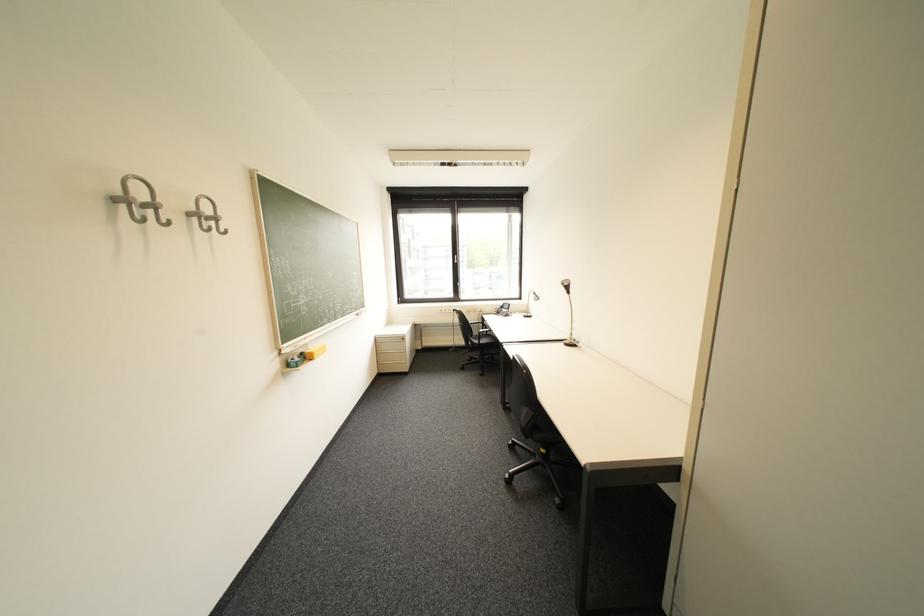
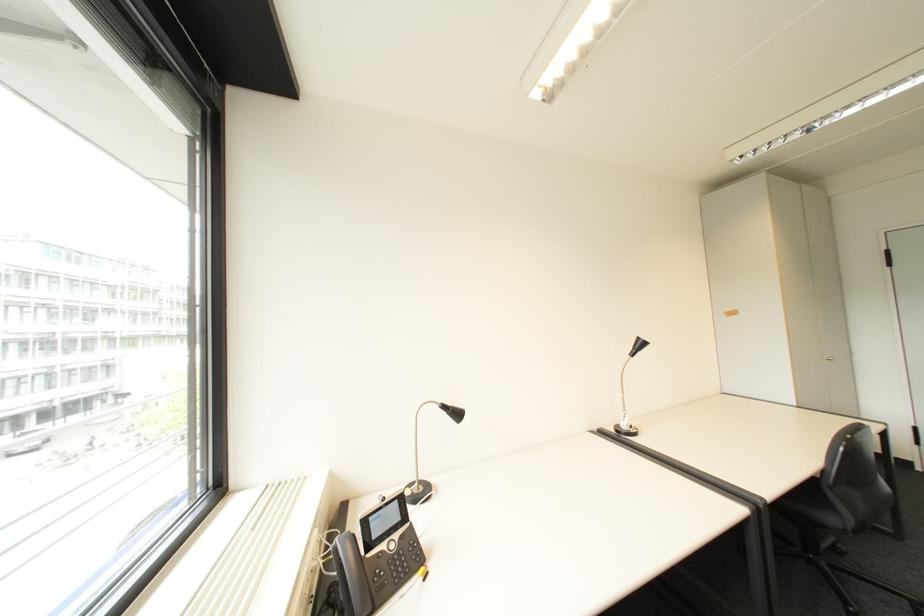
The point at (x=544, y=294) is marked in the first image. Where is the corresponding point in the second image?

(455, 407)